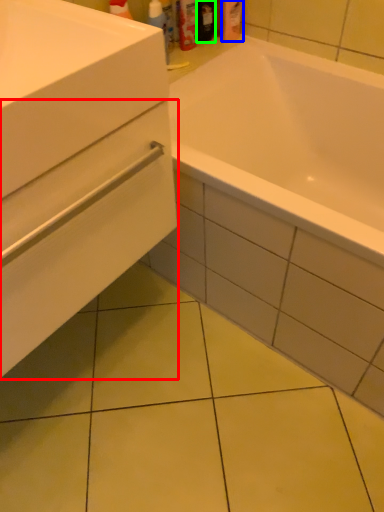
Question: Estimate the real-world distances between objects in this image. Which object is farther from drawer (highlighted by a red box), toiletry (highlighted by a blue box) or toiletry (highlighted by a green box)?

Choices:
 (A) toiletry
 (B) toiletry

Answer: (A)